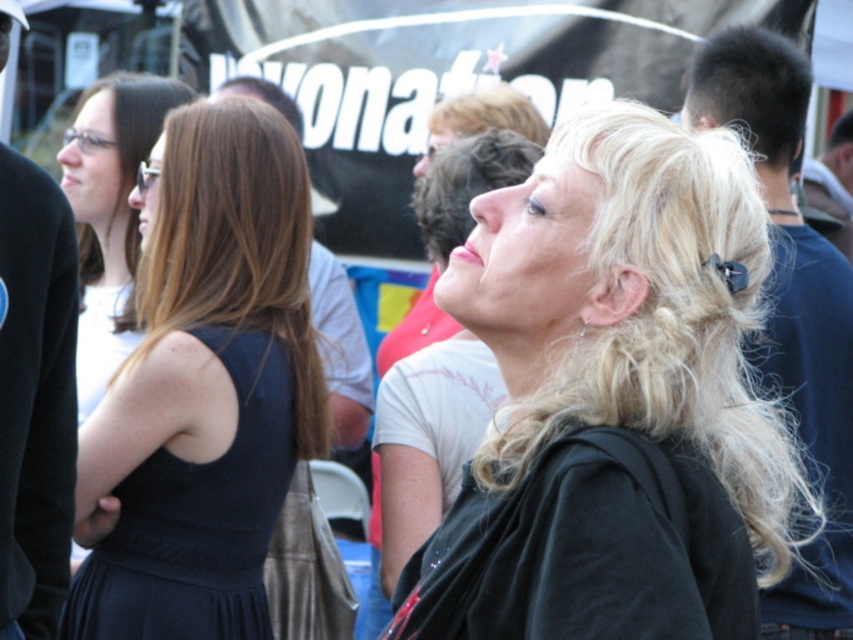
You are at a casual outdoor event and see a woman with blonde hair wearing a black top looking upwards. There is also a dark blue fabric dress at left represented by point (196, 518). Can you tell me the position of the dark blue fabric dress at left relative to the woman with blonde hair?

The dark blue fabric dress at left is located to the left of the woman with blonde hair, as indicated by its coordinates at point (196, 518).

You are a photographer adjusting your camera settings to focus on the blonde hair at center and the matte black shirt at center. Which object should you adjust the focus to first if you want to capture both in sharp detail?

You should focus on the blonde hair at center first because it is closer to the viewer than the matte black shirt at center, ensuring both are in focus when using a shallow depth of field.